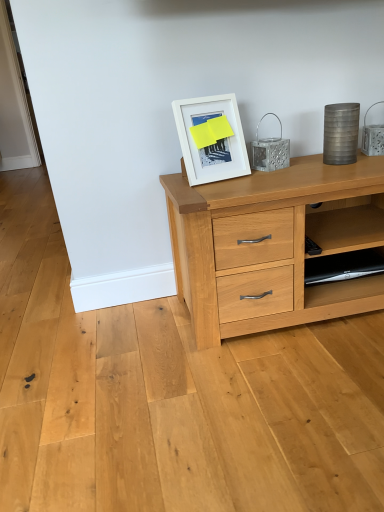
Question: Looking at the image, does white matte picture frame at upper center seem bigger or smaller compared to black plastic shelf at lower right?

Choices:
 (A) big
 (B) small

Answer: (A)

Question: Does point (220, 124) appear closer or farther from the camera than point (342, 290)?

Choices:
 (A) closer
 (B) farther

Answer: (A)

Question: Considering the relative positions of white matte picture frame at upper center and black plastic shelf at lower right in the image provided, is white matte picture frame at upper center to the left or to the right of black plastic shelf at lower right?

Choices:
 (A) left
 (B) right

Answer: (A)

Question: Considering the positions of black plastic shelf at lower right and white matte picture frame at upper center in the image, is black plastic shelf at lower right taller or shorter than white matte picture frame at upper center?

Choices:
 (A) short
 (B) tall

Answer: (A)

Question: Is black plastic shelf at lower right wider or thinner than white matte picture frame at upper center?

Choices:
 (A) wide
 (B) thin

Answer: (A)

Question: From the image's perspective, is black plastic shelf at lower right positioned above or below white matte picture frame at upper center?

Choices:
 (A) above
 (B) below

Answer: (B)

Question: Is black plastic shelf at lower right bigger or smaller than white matte picture frame at upper center?

Choices:
 (A) small
 (B) big

Answer: (A)